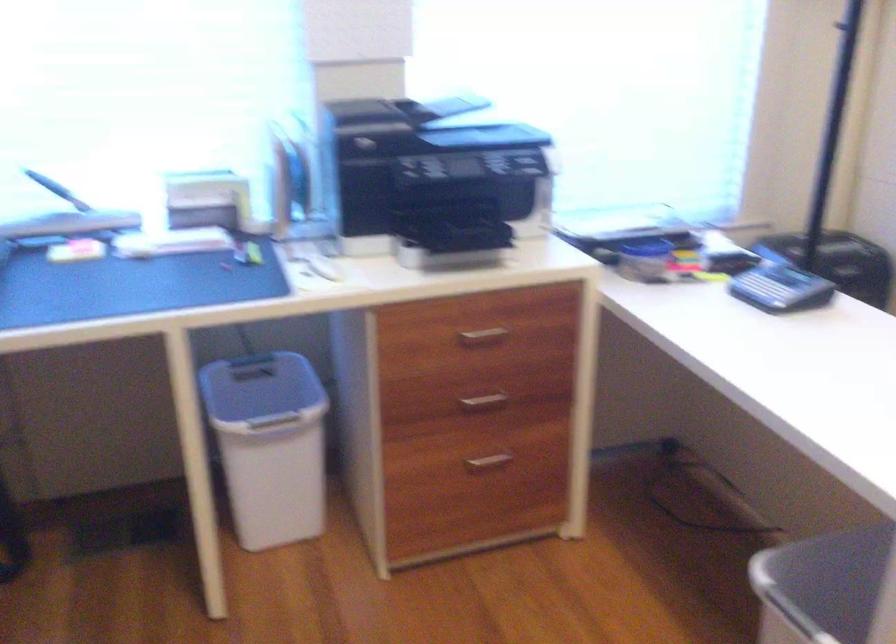
Describe the element at coordinates (261, 390) in the screenshot. The height and width of the screenshot is (644, 896). I see `a trash can lid` at that location.